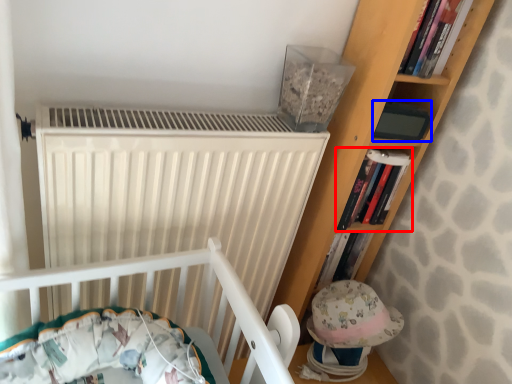
Question: Which object is closer to the camera taking this photo, book (highlighted by a red box) or paperback book (highlighted by a blue box)?

Choices:
 (A) book
 (B) paperback book

Answer: (B)